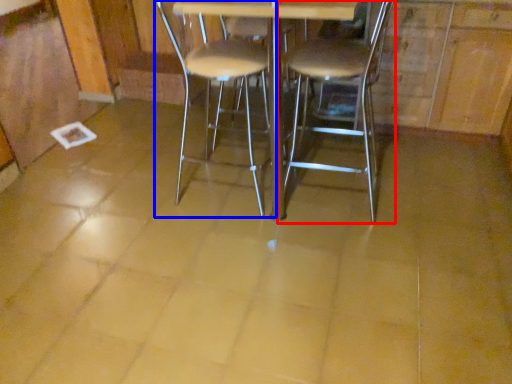
Question: Which object is closer to the camera taking this photo, chair (highlighted by a red box) or chair (highlighted by a blue box)?

Choices:
 (A) chair
 (B) chair

Answer: (A)